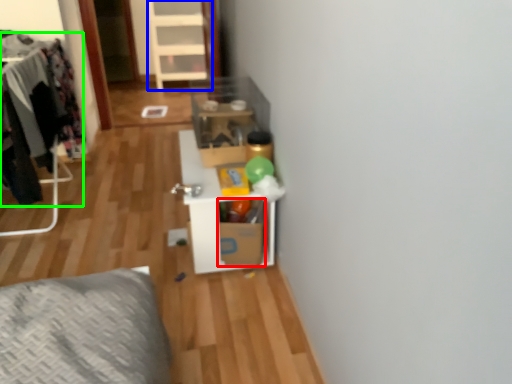
Question: Which is farther away from cardboard box (highlighted by a red box)? dresser (highlighted by a blue box) or clothing (highlighted by a green box)?

Choices:
 (A) dresser
 (B) clothing

Answer: (A)